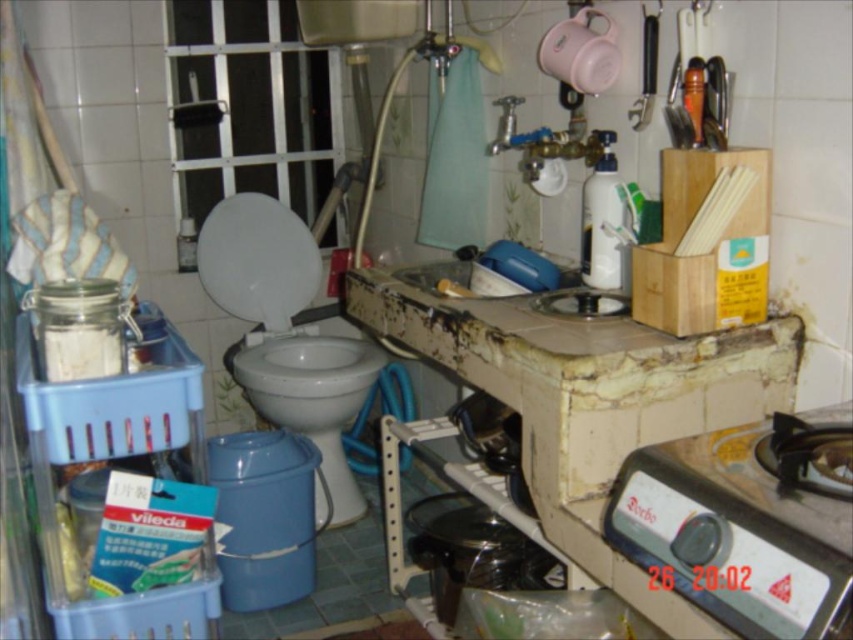
Question: Can you confirm if white glossy toilet bowl at center is positioned above blue plastic sink at center?

Choices:
 (A) yes
 (B) no

Answer: (B)

Question: Which object appears farthest from the camera in this image?

Choices:
 (A) rusty concrete countertop at center
 (B) white glossy toilet bowl at center
 (C) blue plastic sink at center

Answer: (B)

Question: Among these points, which one is nearest to the camera?

Choices:
 (A) (299, 369)
 (B) (556, 468)

Answer: (B)

Question: Can you confirm if rusty concrete countertop at center is positioned above white glossy toilet bowl at center?

Choices:
 (A) no
 (B) yes

Answer: (B)

Question: Can you confirm if white glossy toilet bowl at center is positioned below blue plastic sink at center?

Choices:
 (A) yes
 (B) no

Answer: (A)

Question: Which of these objects is positioned farthest from the rusty concrete countertop at center?

Choices:
 (A) blue plastic sink at center
 (B) white glossy toilet bowl at center

Answer: (B)